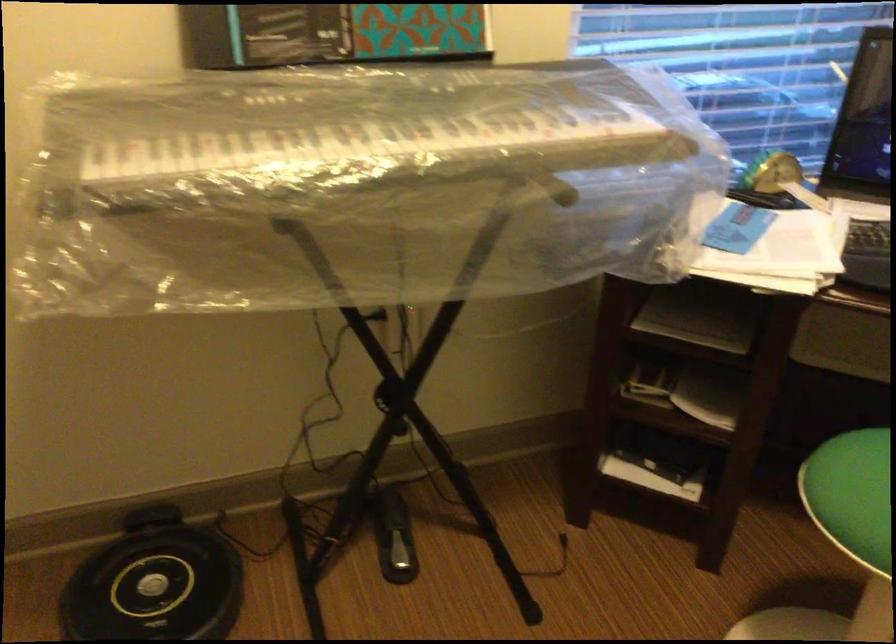
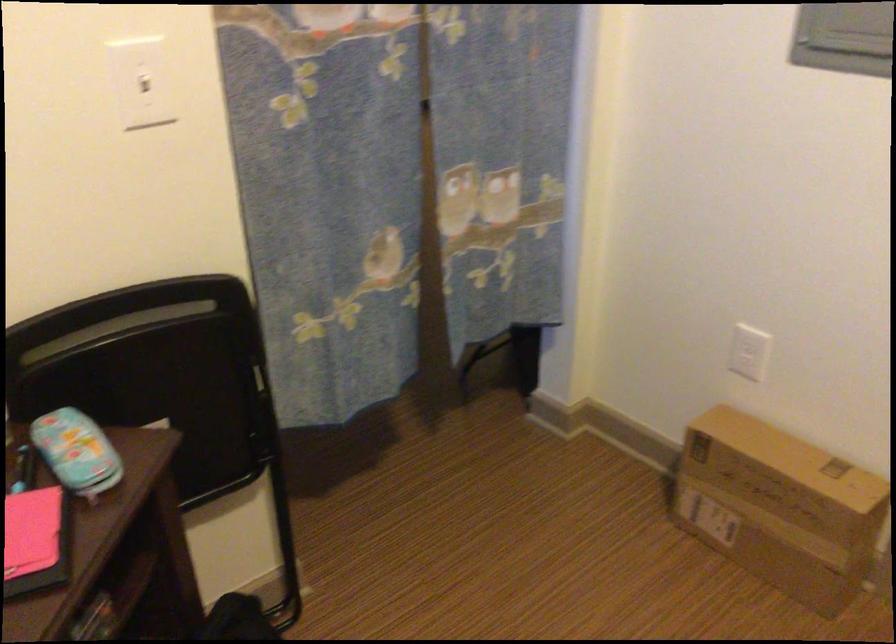
Consider the image. How did the camera likely rotate?

The camera rotated toward right-down.